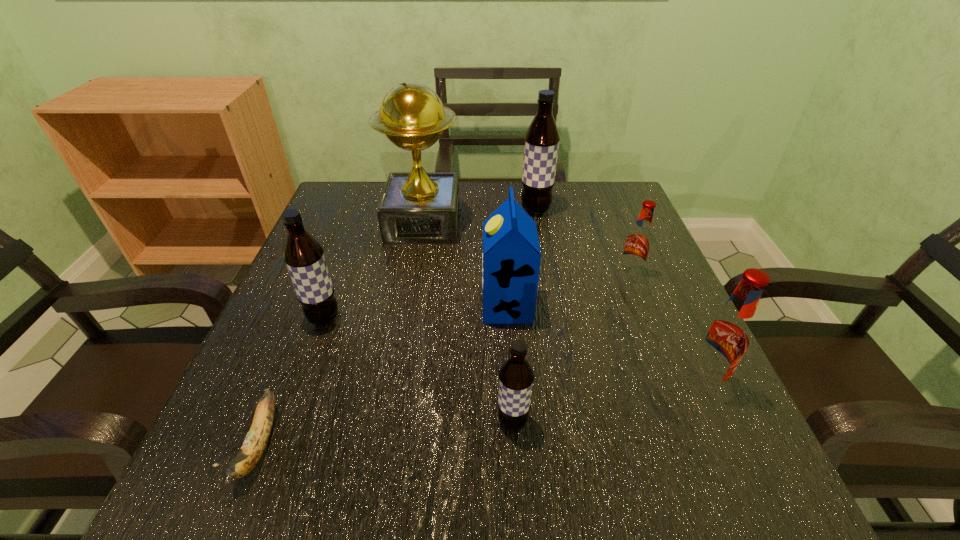
Locate an element on the screen. The height and width of the screenshot is (540, 960). the farther red root beer is located at coordinates (639, 240).

Where is `the second root beer from left to right`? The height and width of the screenshot is (540, 960). the second root beer from left to right is located at coordinates click(516, 376).

Where is `the second brown root beer from left to right`? the second brown root beer from left to right is located at coordinates (516, 376).

Locate an element on the screen. the shortest object is located at coordinates (253, 447).

Where is `vacant space located on the front-facing side of the third object from left to right`? vacant space located on the front-facing side of the third object from left to right is located at coordinates (412, 288).

The image size is (960, 540). In order to click on free space located 0.170m on the left of the tallest root beer in this screenshot , I will do `click(454, 210)`.

Locate an element on the screen. vacant space located with the cap open on the carton is located at coordinates (301, 306).

The width and height of the screenshot is (960, 540). What are the coordinates of `vacant space situated 0.180m with the cap open on the carton` in the screenshot? It's located at (392, 306).

The height and width of the screenshot is (540, 960). Find the location of `free spot located with the cap open on the carton`. free spot located with the cap open on the carton is located at coordinates (427, 306).

Find the location of a particular element. This screenshot has height=540, width=960. vacant space located 0.070m on the left of the bigger red root beer is located at coordinates (640, 382).